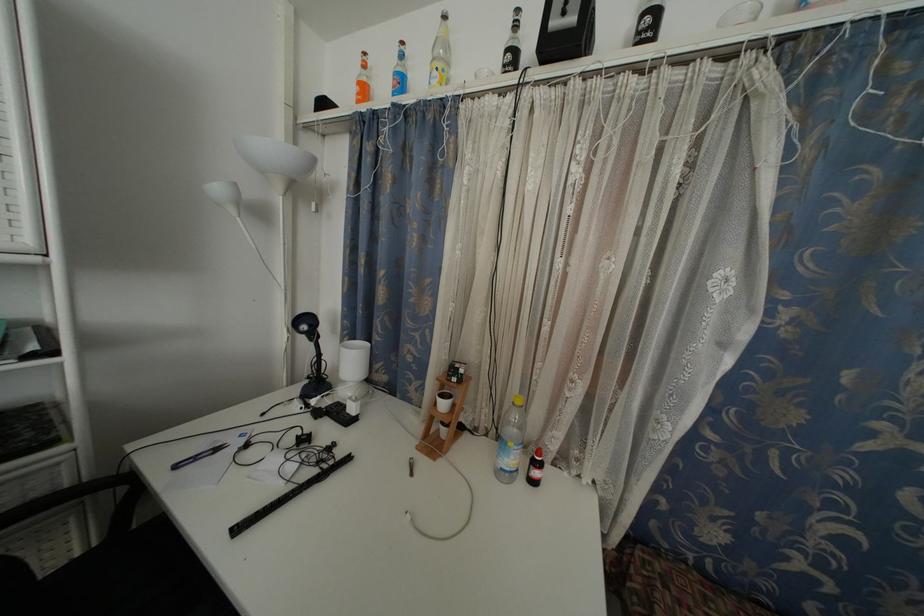
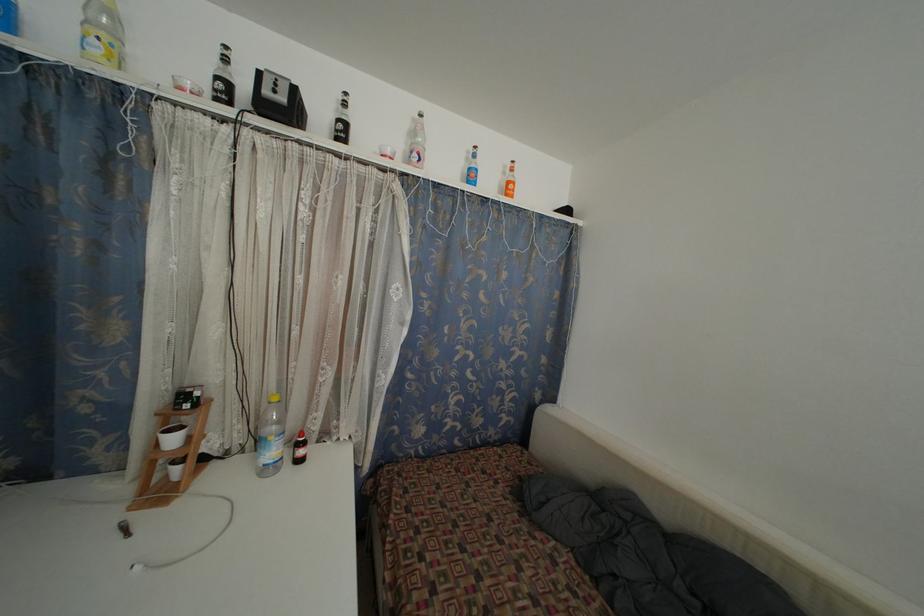
Where in the second image is the point corresponding to (x=540, y=479) from the first image?

(305, 458)